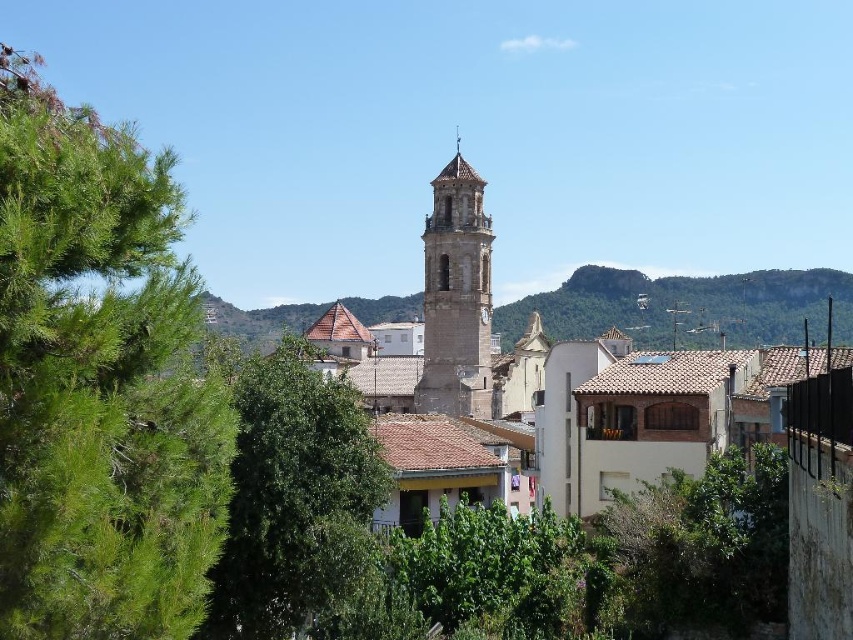
Is point (140, 340) behind point (453, 168)?

That is False.

Is green needle-like leaves at left further to camera compared to smooth stone bell tower at center?

That is False.

Where is `green needle-like leaves at left`? This screenshot has width=853, height=640. green needle-like leaves at left is located at coordinates (99, 385).

Can you confirm if green leafy tree at lower left is wider than smooth stone bell tower at center?

Correct, the width of green leafy tree at lower left exceeds that of smooth stone bell tower at center.

Find the location of `green leafy tree at lower left`. green leafy tree at lower left is located at coordinates (296, 502).

Image resolution: width=853 pixels, height=640 pixels. Identify the location of green leafy tree at lower left. (296, 502).

Is green needle-like leaves at left thinner than green leafy tree at lower left?

In fact, green needle-like leaves at left might be wider than green leafy tree at lower left.

Does green needle-like leaves at left lie behind green leafy tree at lower left?

No.

What do you see at coordinates (99, 385) in the screenshot? This screenshot has height=640, width=853. I see `green needle-like leaves at left` at bounding box center [99, 385].

Where is `green needle-like leaves at left`? This screenshot has width=853, height=640. green needle-like leaves at left is located at coordinates pos(99,385).